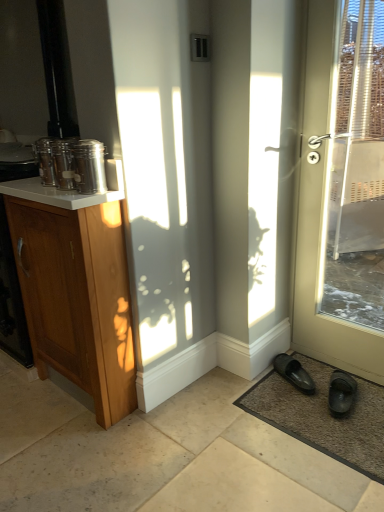
Where is `vacant area that is in front of wooden cabinet at left`? vacant area that is in front of wooden cabinet at left is located at coordinates (x=115, y=452).